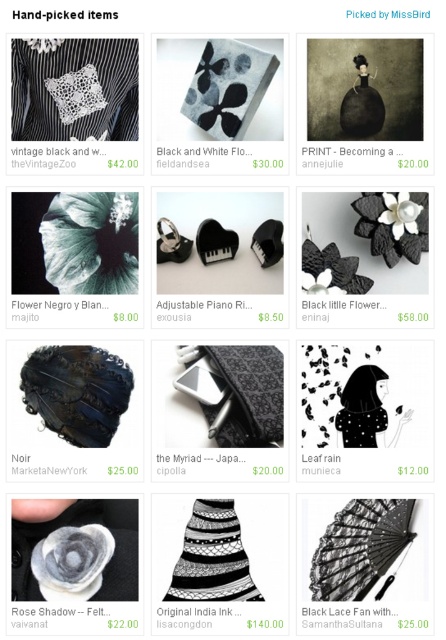
Question: Which point is farther from the camera taking this photo?

Choices:
 (A) (272, 228)
 (B) (66, 356)
 (C) (228, 579)

Answer: (A)

Question: Does dark blue lace crochet at center have a greater width compared to black lace fan at center?

Choices:
 (A) yes
 (B) no

Answer: (A)

Question: Is black lace crochet at center closer to camera compared to black and white crochet at center?

Choices:
 (A) no
 (B) yes

Answer: (A)

Question: Which object is the farthest from the black and white crochet at center?

Choices:
 (A) dark blue lace crochet at center
 (B) black felt hat at center
 (C) black lace crochet at center
 (D) black lace fan at center

Answer: (B)

Question: Can you confirm if black lace crochet at center is smaller than black lace fan at center?

Choices:
 (A) yes
 (B) no

Answer: (B)

Question: Which of the following is the farthest from the observer?

Choices:
 (A) pyautogui.click(x=211, y=404)
 (B) pyautogui.click(x=323, y=572)
 (C) pyautogui.click(x=239, y=564)

Answer: (A)